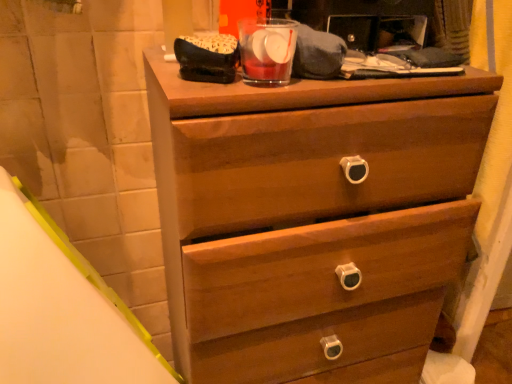
In order to click on spots to the right of transparent glass at upper center in this screenshot , I will do `click(369, 84)`.